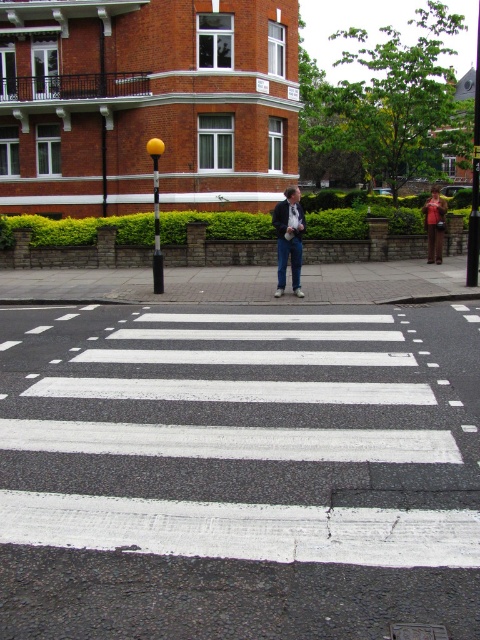
Question: Which point is closer to the camera taking this photo?

Choices:
 (A) (436, 216)
 (B) (290, 198)

Answer: (B)

Question: Does dark blue jeans at center have a greater width compared to brown leather jacket at upper right?

Choices:
 (A) yes
 (B) no

Answer: (A)

Question: Which point is farther to the camera?

Choices:
 (A) brown leather jacket at upper right
 (B) dark blue jeans at center

Answer: (A)

Question: Can you confirm if dark blue jeans at center is positioned below brown leather jacket at upper right?

Choices:
 (A) no
 (B) yes

Answer: (B)

Question: Is dark blue jeans at center above brown leather jacket at upper right?

Choices:
 (A) no
 (B) yes

Answer: (A)